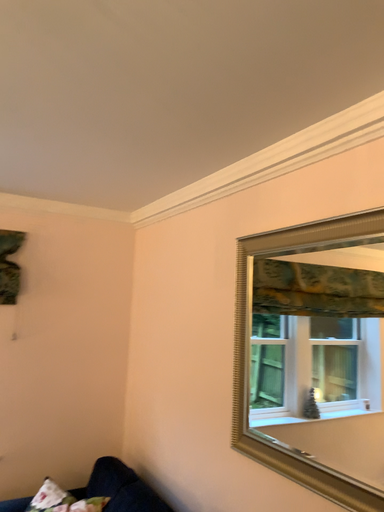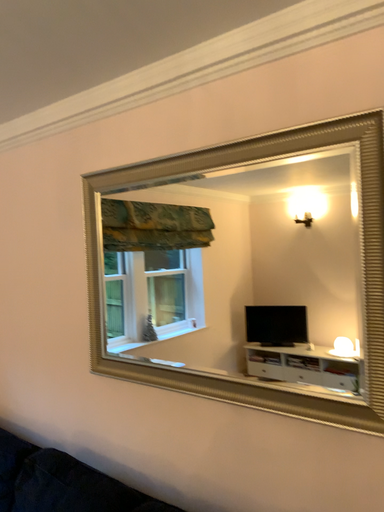
Question: Which way did the camera rotate in the video?

Choices:
 (A) rotated upward
 (B) rotated downward

Answer: (B)